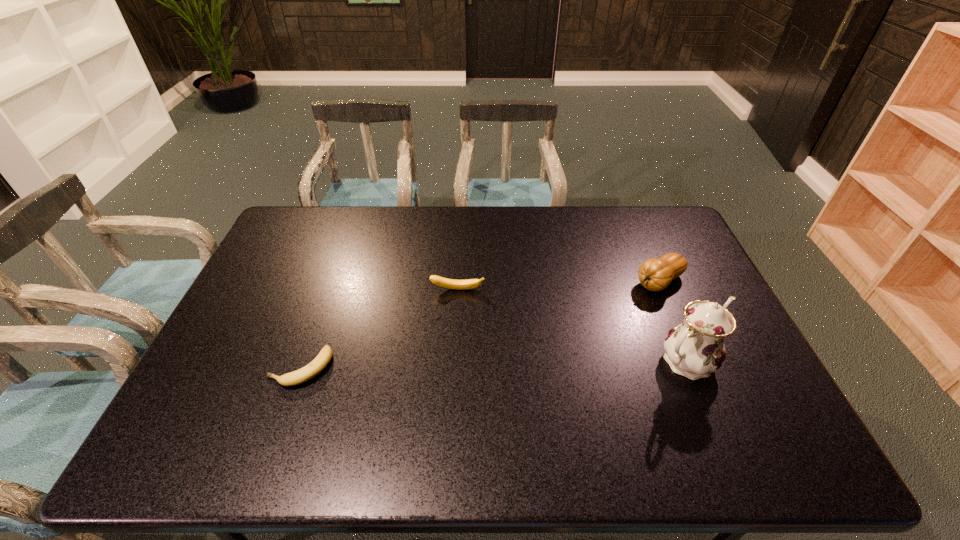
Find the location of `the shortest object`. the shortest object is located at coordinates (309, 371).

Find the location of a particular element. This screenshot has width=960, height=540. the left banana is located at coordinates (309, 371).

The height and width of the screenshot is (540, 960). I want to click on the tallest object, so click(695, 348).

This screenshot has width=960, height=540. Find the location of `the farther banana`. the farther banana is located at coordinates (440, 281).

Find the location of a particular element. The image size is (960, 540). the right banana is located at coordinates (440, 281).

Find the location of `the third shortest object`. the third shortest object is located at coordinates (655, 274).

You are a GUI agent. You are given a task and a screenshot of the screen. Output one action in this format:
    pyautogui.click(x=<x>, y=<y>)
    Task: Click on the vacant area located 0.090m on the back of the leftmost object
    The image size is (960, 540).
    Given the screenshot: What is the action you would take?
    pyautogui.click(x=317, y=323)

Find the location of `free spot located 0.130m on the back of the tallest object`. free spot located 0.130m on the back of the tallest object is located at coordinates (662, 306).

Where is `vacant position located 0.100m at the stem of the right banana`? vacant position located 0.100m at the stem of the right banana is located at coordinates (457, 318).

The height and width of the screenshot is (540, 960). Identify the location of free space located at the stem of the right banana. (456, 336).